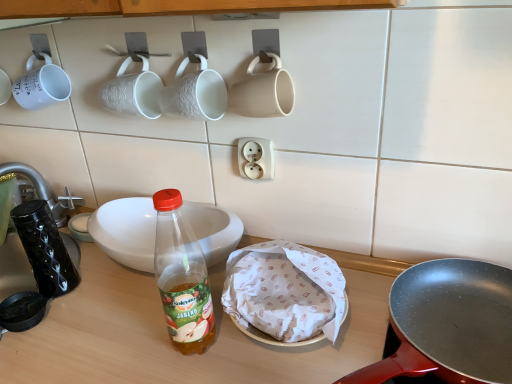
Question: Are white textured mug at upper center, the third coffee cup in the right-to-left sequence, and white ceramic bowl at center far apart?

Choices:
 (A) no
 (B) yes

Answer: (A)

Question: From a real-world perspective, is white textured mug at upper center, the third coffee cup in the right-to-left sequence, over white ceramic bowl at center?

Choices:
 (A) no
 (B) yes

Answer: (B)

Question: Can you confirm if white textured mug at upper center, the 2th coffee cup in the left-to-right sequence, is positioned to the right of white ceramic bowl at center?

Choices:
 (A) yes
 (B) no

Answer: (B)

Question: Would you say white textured mug at upper center, the 2th coffee cup in the left-to-right sequence, contains white ceramic bowl at center?

Choices:
 (A) yes
 (B) no

Answer: (B)

Question: Considering the relative sizes of white textured mug at upper center, the 2th coffee cup in the left-to-right sequence, and white ceramic bowl at center in the image provided, is white textured mug at upper center, the 2th coffee cup in the left-to-right sequence, shorter than white ceramic bowl at center?

Choices:
 (A) yes
 (B) no

Answer: (B)

Question: Is white textured mug at upper center, the third coffee cup in the right-to-left sequence, aimed at white ceramic bowl at center?

Choices:
 (A) no
 (B) yes

Answer: (A)

Question: From a real-world perspective, is matte white mug at upper center, the fourth coffee cup in the left-to-right sequence, physically below white matte mug at upper left, the fourth coffee cup positioned from the right?

Choices:
 (A) yes
 (B) no

Answer: (A)

Question: Is matte white mug at upper center, the 1th coffee cup from the right, aimed at white matte mug at upper left, the 1th coffee cup from the left?

Choices:
 (A) no
 (B) yes

Answer: (A)

Question: Does matte white mug at upper center, the 1th coffee cup from the right, have a smaller size compared to white matte mug at upper left, the fourth coffee cup positioned from the right?

Choices:
 (A) yes
 (B) no

Answer: (A)

Question: Can you confirm if matte white mug at upper center, the 1th coffee cup from the right, is thinner than white matte mug at upper left, the 1th coffee cup from the left?

Choices:
 (A) yes
 (B) no

Answer: (A)

Question: Is matte white mug at upper center, the 1th coffee cup from the right, closer to camera compared to white matte mug at upper left, the 1th coffee cup from the left?

Choices:
 (A) no
 (B) yes

Answer: (B)

Question: Is matte white mug at upper center, the fourth coffee cup in the left-to-right sequence, bigger than white matte mug at upper left, the fourth coffee cup positioned from the right?

Choices:
 (A) no
 (B) yes

Answer: (A)

Question: Is matte black frying pan at center right surrounding white matte mug at upper left, the fourth coffee cup positioned from the right?

Choices:
 (A) no
 (B) yes

Answer: (A)